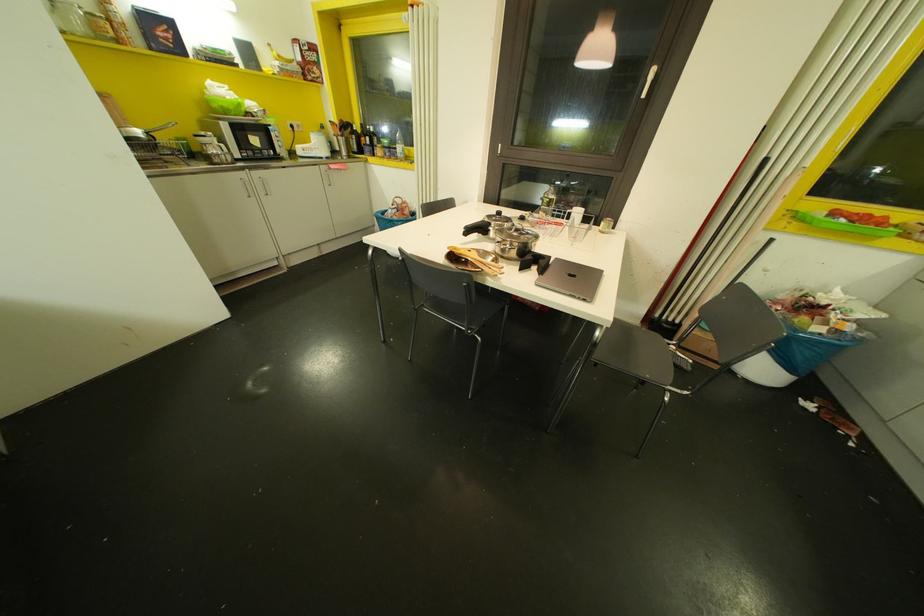
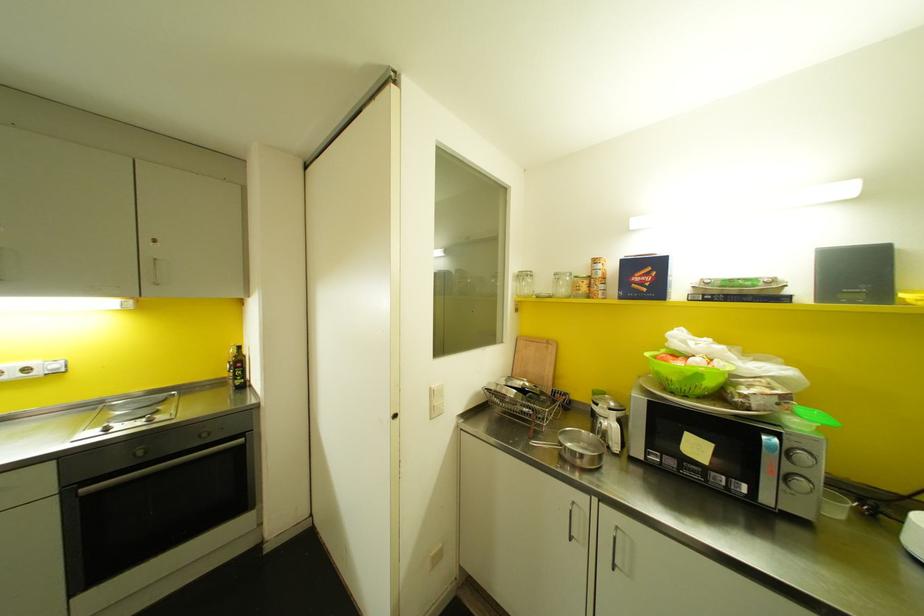
The point at [238,103] is marked in the first image. Where is the corresponding point in the second image?

(698, 376)